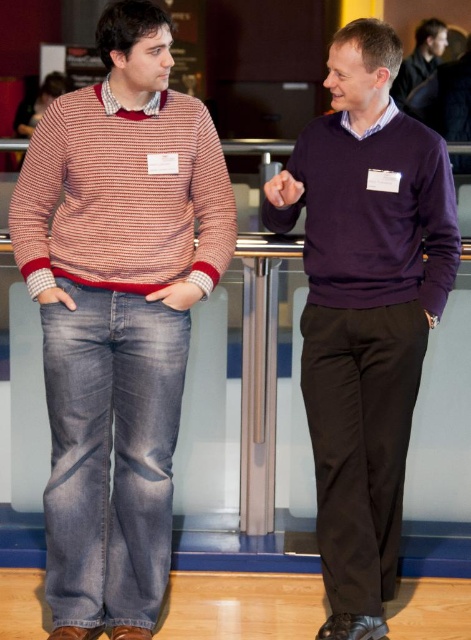
You are an event planner arranging seating for a photo opportunity. You need to place two people wearing the matte red and white sweater at left and the matte purple sweater at upper right so that their positions match the original image. If the photo area has a glass panel backdrop, where should each person stand relative to the other?

The matte red and white sweater at left should stand below the matte purple sweater at upper right to mirror their original positions in the image.

You are standing in the conference room and want to determine which of the two points, point (327,228) or point (402,83), is nearer to you. Based on the scene description, which point is closer?

Point (327,228) is closer to the camera than point (402,83), so it is the closer one.

You are an event planner arranging seating for a photo op. You need to place two people wearing the matte red and white sweater at left and the purple matte sweater at center. Based on their current positions, which person should be positioned closer to the camera to maintain their original spatial relationship?

The matte red and white sweater at left should be positioned closer to the camera since it is originally located above the purple matte sweater at center, indicating it is nearer in the original image.